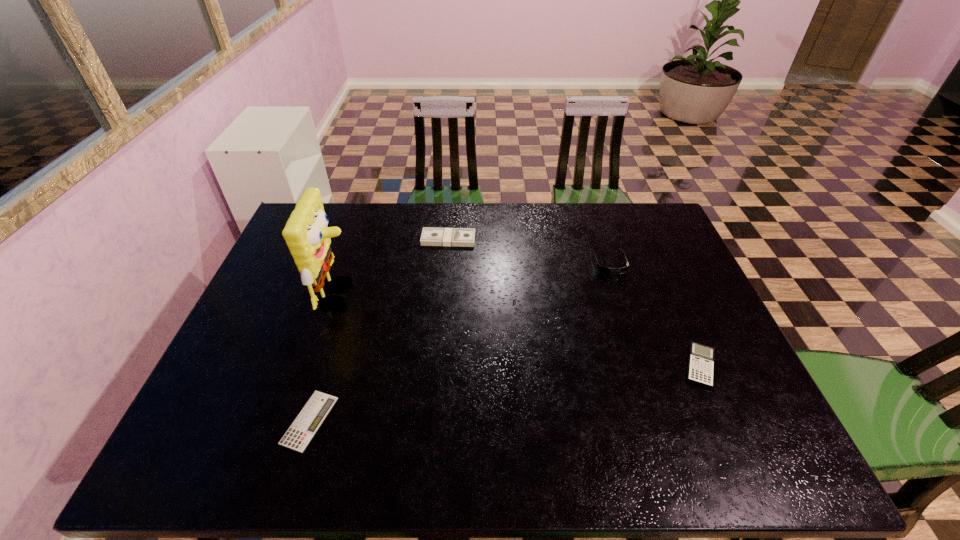
Locate an element on the screen. free location at the right edge is located at coordinates coord(754,395).

This screenshot has width=960, height=540. Identify the location of vacant space at the far right corner of the desktop. (677, 244).

Identify the location of free space at the near right corner of the desktop. The image size is (960, 540). (733, 450).

At what (x,y) coordinates should I click in order to perform the action: click on vacant point located between the tallest object and the shorter calculator. Please return your answer as a coordinate pair (x, y). Looking at the image, I should click on (324, 357).

Identify the location of blank region between the nearer calculator and the second object from right to left. The height and width of the screenshot is (540, 960). (459, 341).

Image resolution: width=960 pixels, height=540 pixels. Find the location of `empty space that is in between the rightmost object and the sponge`. empty space that is in between the rightmost object and the sponge is located at coordinates (520, 330).

Find the location of a particular element. This screenshot has width=960, height=540. vacant space that's between the tallest object and the dollar is located at coordinates [x=394, y=267].

Identify the location of vacant point located between the third shortest object and the sunglasses. The height and width of the screenshot is (540, 960). (529, 251).

Locate an element on the screen. The height and width of the screenshot is (540, 960). free space between the nearer calculator and the fourth shortest object is located at coordinates (459, 341).

The width and height of the screenshot is (960, 540). What are the coordinates of `vacant area that lies between the sponge and the farther calculator` in the screenshot? It's located at (520, 330).